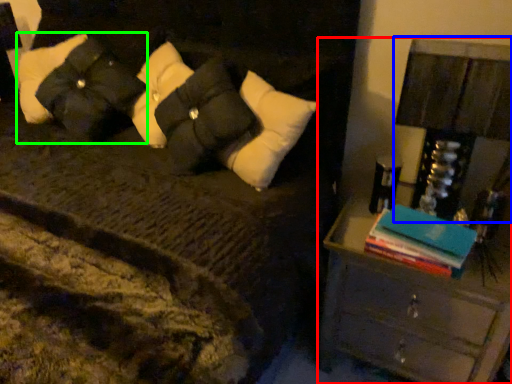
Question: Which object is the farthest from nightstand (highlighted by a red box)? Choose among these: bedside lamp (highlighted by a blue box) or pillow (highlighted by a green box).

Choices:
 (A) bedside lamp
 (B) pillow

Answer: (B)